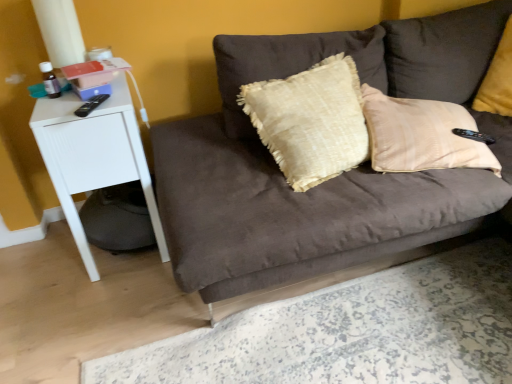
Question: Considering the relative sizes of velvet yellow pillow at upper right and white matte side table at left in the image provided, is velvet yellow pillow at upper right taller than white matte side table at left?

Choices:
 (A) yes
 (B) no

Answer: (B)

Question: Does velvet yellow pillow at upper right appear on the right side of white matte side table at left?

Choices:
 (A) no
 (B) yes

Answer: (B)

Question: Is velvet yellow pillow at upper right smaller than white matte side table at left?

Choices:
 (A) yes
 (B) no

Answer: (A)

Question: Does velvet yellow pillow at upper right have a larger size compared to white matte side table at left?

Choices:
 (A) no
 (B) yes

Answer: (A)

Question: From a real-world perspective, is velvet yellow pillow at upper right beneath white matte side table at left?

Choices:
 (A) no
 (B) yes

Answer: (A)

Question: Is the depth of velvet yellow pillow at upper right less than that of white matte side table at left?

Choices:
 (A) yes
 (B) no

Answer: (B)

Question: Can suede brown couch at center be found inside white matte side table at left?

Choices:
 (A) no
 (B) yes

Answer: (A)

Question: Does white matte side table at left have a larger size compared to suede brown couch at center?

Choices:
 (A) yes
 (B) no

Answer: (B)

Question: Does white matte side table at left have a greater height compared to suede brown couch at center?

Choices:
 (A) no
 (B) yes

Answer: (B)

Question: Does white matte side table at left lie behind suede brown couch at center?

Choices:
 (A) yes
 (B) no

Answer: (A)

Question: From the image's perspective, is white matte side table at left on top of suede brown couch at center?

Choices:
 (A) no
 (B) yes

Answer: (A)

Question: From the image's perspective, is white matte side table at left located beneath suede brown couch at center?

Choices:
 (A) no
 (B) yes

Answer: (B)

Question: Can you confirm if suede brown couch at center is positioned to the right of white matte side table at left?

Choices:
 (A) no
 (B) yes

Answer: (B)